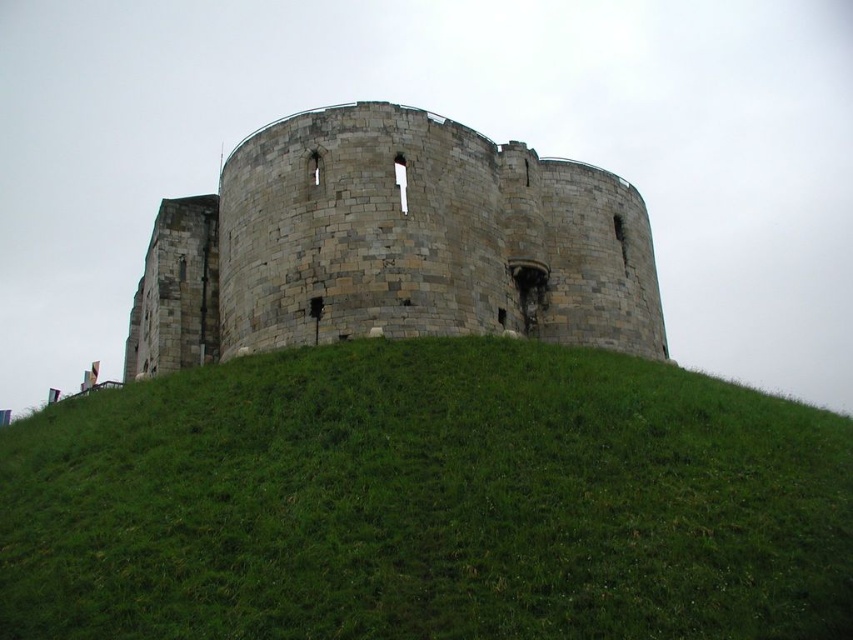
You are a drone operator trying to land a drone on the green grassy hill at center. The drone has a GPS coordinate system where the bottom left corner is the origin point. What coordinate should you target to land the drone?

The green grassy hill at center is located at coordinate point (x=427, y=502), so you should target that coordinate to land the drone.

You are standing at the base of the stone castle at center and want to reach the green grassy hill at center. In which direction should you walk to get there?

To reach the green grassy hill at center from the stone castle at center, you should walk to the right since the green grassy hill at center is located to the right of the stone castle at center.

You are a construction worker planning to build a new pathway from the base of the stone castle at center to the green grassy hill at center. The pathway must be exactly 45 feet long. Will the pathway reach the hill without needing adjustments?

The distance between the green grassy hill at center and the stone castle at center is 47.70 feet. Since the pathway is planned to be 45 feet long, it will fall short by 2.70 feet and adjustments will be needed to ensure it reaches the hill.